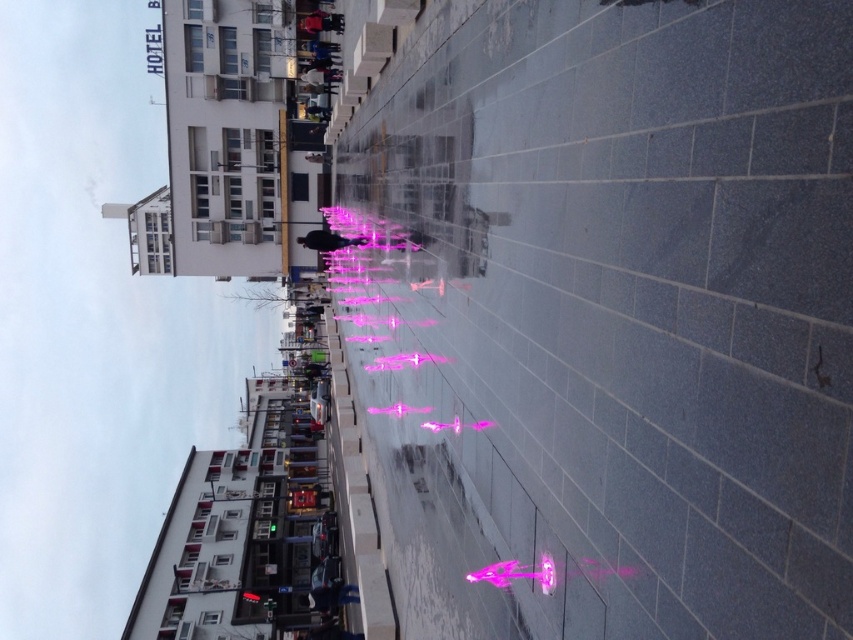
Is pink glossy fountain at center further to the viewer compared to matte black person at center?

No.

Locate an element on the screen. pink glossy fountain at center is located at coordinates (419, 326).

Where is `pink glossy fountain at center`? The height and width of the screenshot is (640, 853). pink glossy fountain at center is located at coordinates (419, 326).

The height and width of the screenshot is (640, 853). I want to click on pink glossy fountain at center, so click(x=419, y=326).